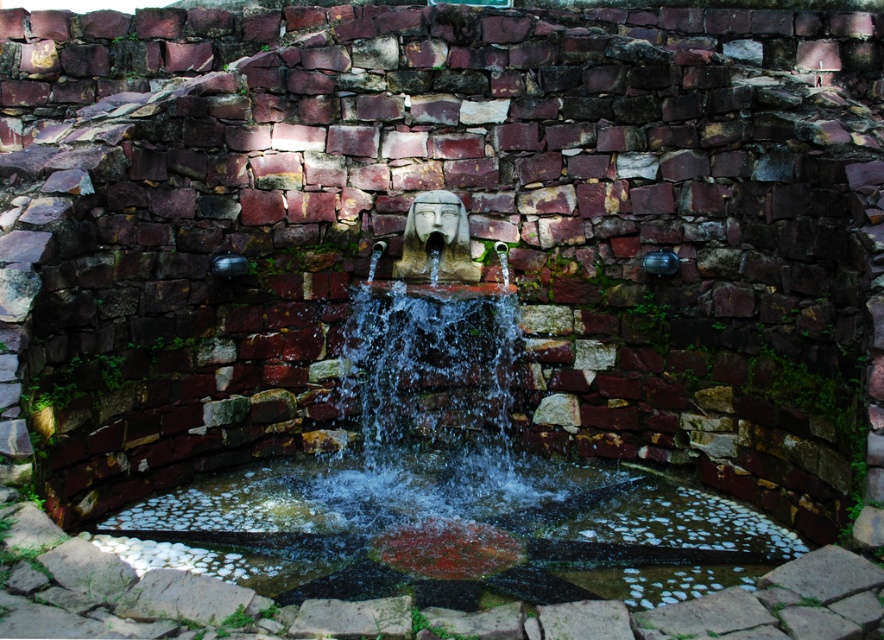
You are standing at the edge of the circular stone basin in the image. There is a point marked at coordinates (448, 490). What object does this point mark?

The point marked at coordinates (448, 490) marks the stone fountain at center.

You are a maintenance worker tasked with cleaning the stone fountain at center and the clear water at center. You have a 1.2 meter long tool. Can you reach both objects without moving your position?

The distance between the stone fountain at center and the clear water at center is 1.13 meters, so yes, the tool can reach both objects since the tool is longer than the distance between them.

You are standing in front of the fountain and want to know if the stone fountain at center is taller than the clear water at center. Can you confirm this based on the scene?

The stone fountain at center is taller than clear water at center according to the description.